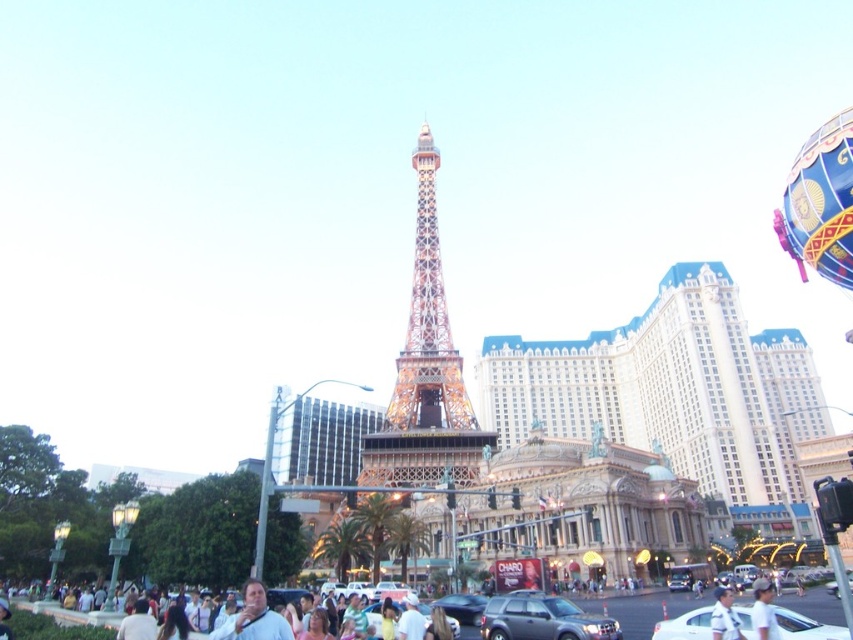
Is matte black suv at center positioned at the back of white matte crowd at lower center?

No, matte black suv at center is in front of white matte crowd at lower center.

Between matte black suv at center and white matte crowd at lower center, which one is positioned lower?

white matte crowd at lower center is below.

Find the location of a particular element. The image size is (853, 640). matte black suv at center is located at coordinates (543, 620).

From the picture: Is matte black suv at center closer to camera compared to white glossy car at lower center?

No, it is not.

Does matte black suv at center have a lesser width compared to white glossy car at lower center?

Indeed, matte black suv at center has a lesser width compared to white glossy car at lower center.

Is point (485, 634) less distant than point (753, 625)?

No, (485, 634) is further to viewer.

Where is `matte black suv at center`? matte black suv at center is located at coordinates (543, 620).

Can you confirm if shiny metallic eiffel tower at center is bigger than white matte crowd at lower center?

Indeed, shiny metallic eiffel tower at center has a larger size compared to white matte crowd at lower center.

Does point (434, 205) come farther from viewer compared to point (53, 618)?

Yes, it is.

Find the location of a particular element. The image size is (853, 640). shiny metallic eiffel tower at center is located at coordinates (427, 323).